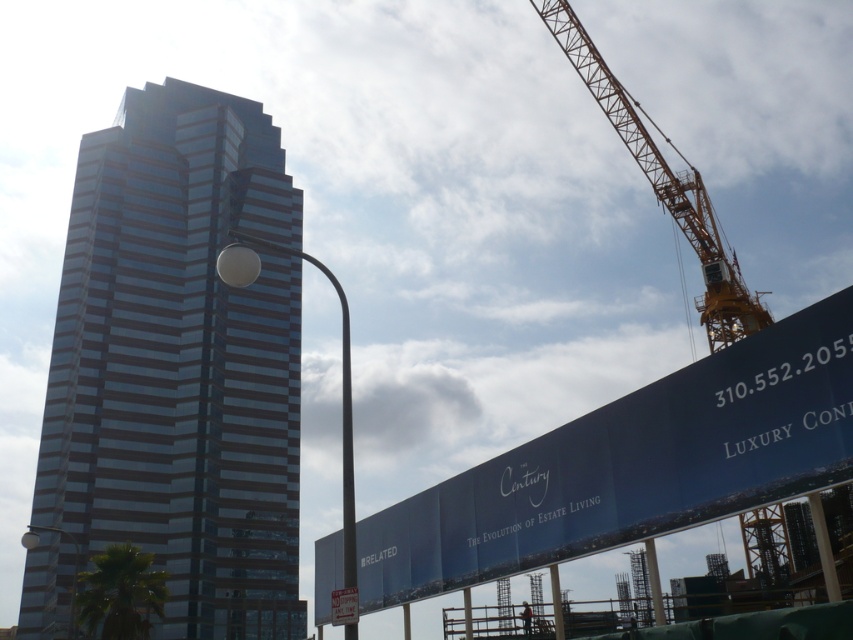
Question: Where is shiny glass skyscraper at center located in relation to yellow metallic crane at upper right in the image?

Choices:
 (A) below
 (B) above

Answer: (B)

Question: Among these points, which one is farthest from the camera?

Choices:
 (A) (57, 593)
 (B) (775, 516)

Answer: (A)

Question: Is shiny glass skyscraper at center bigger than yellow metallic crane at upper right?

Choices:
 (A) no
 (B) yes

Answer: (B)

Question: Among these objects, which one is nearest to the camera?

Choices:
 (A) shiny glass skyscraper at center
 (B) yellow metallic crane at upper right

Answer: (B)

Question: Does shiny glass skyscraper at center appear on the left side of yellow metallic crane at upper right?

Choices:
 (A) yes
 (B) no

Answer: (A)

Question: Which point is closer to the camera taking this photo?

Choices:
 (A) (228, 380)
 (B) (564, 44)

Answer: (B)